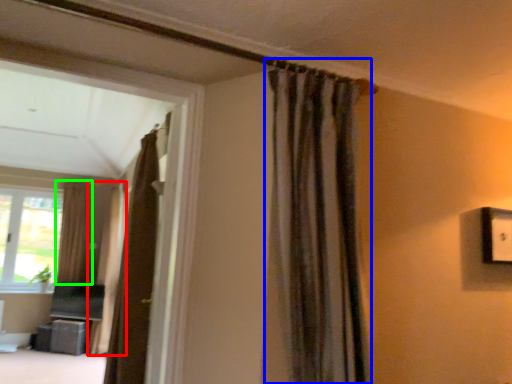
Question: Which object is the closest to the curtain (highlighted by a red box)? Choose among these: curtain (highlighted by a blue box) or curtain (highlighted by a green box).

Choices:
 (A) curtain
 (B) curtain

Answer: (B)